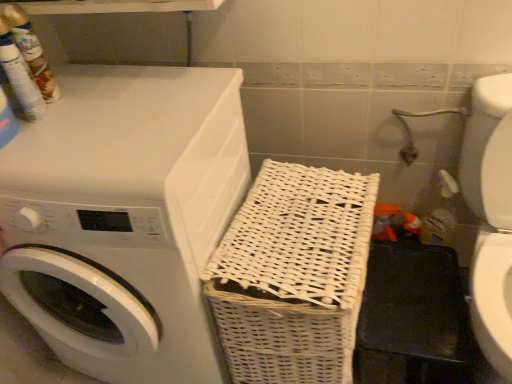
The height and width of the screenshot is (384, 512). Find the location of `white matte/woven laundry basket at right`. white matte/woven laundry basket at right is located at coordinates (124, 218).

In order to face white glossy washer at lower right, should I rotate leftwards or rightwards?

Turn right approximately 31.708 degrees to face it.

The image size is (512, 384). What are the coordinates of `white matte/woven laundry basket at right` in the screenshot? It's located at (124, 218).

Is white matte/woven laundry basket at right directly adjacent to white wicker basket at center?

No, white matte/woven laundry basket at right is not touching white wicker basket at center.

How many degrees apart are the facing directions of white matte/woven laundry basket at right and white wicker basket at center?

The angular difference between white matte/woven laundry basket at right and white wicker basket at center is 4.88 degrees.

Is white matte/woven laundry basket at right facing away from white wicker basket at center?

white matte/woven laundry basket at right is not turned away from white wicker basket at center.

How different are the orientations of white glossy washer at lower right and white wicker basket at center in degrees?

They differ by 5.56 degrees in their facing directions.

From a real-world perspective, between white glossy washer at lower right and white wicker basket at center, who is vertically higher?

white glossy washer at lower right is physically above.

You are a GUI agent. You are given a task and a screenshot of the screen. Output one action in this format:
    pyautogui.click(x=<x>, y=<y>)
    Task: Click on the basket on the left of white glossy washer at lower right
    The width and height of the screenshot is (512, 384).
    Given the screenshot: What is the action you would take?
    pyautogui.click(x=293, y=275)

From the image's perspective, would you say white glossy washer at lower right is positioned over white wicker basket at center?

Yes.

Is white wicker basket at center turned away from white glossy washer at lower right?

white wicker basket at center is not turned away from white glossy washer at lower right.

Which object is positioned more to the right, white wicker basket at center or white glossy washer at lower right?

white glossy washer at lower right is more to the right.

How different are the orientations of white wicker basket at center and white glossy washer at lower right in degrees?

They differ by 5.56 degrees in their facing directions.

Considering the sizes of objects white wicker basket at center and white glossy washer at lower right in the image provided, who is bigger, white wicker basket at center or white glossy washer at lower right?

Bigger between the two is white glossy washer at lower right.

Considering the sizes of white wicker basket at center and white matte/woven laundry basket at right in the image, is white wicker basket at center wider or thinner than white matte/woven laundry basket at right?

Clearly, white wicker basket at center has less width compared to white matte/woven laundry basket at right.

Which is correct: white wicker basket at center is inside white matte/woven laundry basket at right, or outside of it?

white wicker basket at center is not inside white matte/woven laundry basket at right, it's outside.

Could you tell me if white wicker basket at center is turned towards white matte/woven laundry basket at right?

No, white wicker basket at center is not aimed at white matte/woven laundry basket at right.

Which object is positioned more to the right, white matte/woven laundry basket at right or white glossy washer at lower right?

white glossy washer at lower right is more to the right.

The width and height of the screenshot is (512, 384). Identify the location of washing machine located behind the white glossy washer at lower right. (124, 218).

From a real-world perspective, is white matte/woven laundry basket at right above or below white glossy washer at lower right?

In terms of real-world spatial position, white matte/woven laundry basket at right is above white glossy washer at lower right.

Is white matte/woven laundry basket at right facing towards white glossy washer at lower right?

No, white matte/woven laundry basket at right is not turned towards white glossy washer at lower right.

Is white glossy washer at lower right shorter than white matte/woven laundry basket at right?

Yes, white glossy washer at lower right is shorter than white matte/woven laundry basket at right.

Which is behind, point (489, 316) or point (93, 330)?

Point (93, 330)

Is white glossy washer at lower right looking in the opposite direction of white matte/woven laundry basket at right?

No, white glossy washer at lower right is not facing away from white matte/woven laundry basket at right.

Where is `washer below the white matte/woven laundry basket at right (from the image's perspective)`? Image resolution: width=512 pixels, height=384 pixels. washer below the white matte/woven laundry basket at right (from the image's perspective) is located at coordinates (490, 216).

This screenshot has height=384, width=512. Find the location of `basket below the white matte/woven laundry basket at right (from the image's perspective)`. basket below the white matte/woven laundry basket at right (from the image's perspective) is located at coordinates (293, 275).

What are the coordinates of `basket lying on the left of white glossy washer at lower right` in the screenshot? It's located at (293, 275).

Considering their positions, is white matte/woven laundry basket at right positioned closer to white glossy washer at lower right than white wicker basket at center?

Among the two, white wicker basket at center is located nearer to white glossy washer at lower right.

Based on their spatial positions, is white wicker basket at center or white glossy washer at lower right further from white matte/woven laundry basket at right?

The object further to white matte/woven laundry basket at right is white glossy washer at lower right.

Considering their positions, is white wicker basket at center positioned further to white glossy washer at lower right than white matte/woven laundry basket at right?

white matte/woven laundry basket at right is further to white glossy washer at lower right.

From the image, which object appears to be farther from white wicker basket at center, white matte/woven laundry basket at right or white glossy washer at lower right?

white glossy washer at lower right.

From the image, which object appears to be farther from white matte/woven laundry basket at right, white glossy washer at lower right or white wicker basket at center?

Based on the image, white glossy washer at lower right appears to be further to white matte/woven laundry basket at right.

Looking at the image, which one is located further to white wicker basket at center, white glossy washer at lower right or white matte/woven laundry basket at right?

white glossy washer at lower right is positioned further to the anchor white wicker basket at center.

At what (x,y) coordinates should I click in order to perform the action: click on basket situated between white matte/woven laundry basket at right and white glossy washer at lower right from left to right. Please return your answer as a coordinate pair (x, y). Looking at the image, I should click on (293, 275).